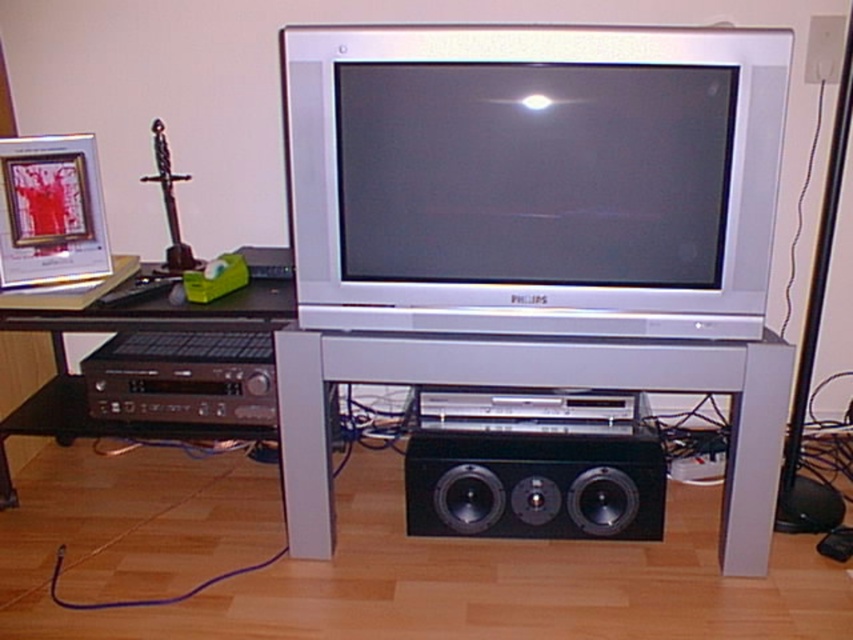
Question: Does black plastic stereo at lower left have a greater width compared to black plastic computer desk at lower left?

Choices:
 (A) no
 (B) yes

Answer: (A)

Question: Among these objects, which one is farthest from the camera?

Choices:
 (A) black plastic stereo at lower left
 (B) black plastic computer desk at lower left
 (C) black matte speaker at lower center
 (D) silver metallic flat screen tv at center

Answer: (A)

Question: Which point is farther to the camera?

Choices:
 (A) black plastic stereo at lower left
 (B) silver metallic flat screen tv at center

Answer: (A)

Question: Can you confirm if silver metallic flat screen tv at center is positioned to the left of black matte speaker at lower center?

Choices:
 (A) no
 (B) yes

Answer: (B)

Question: Does silver metallic flat screen tv at center lie in front of black matte speaker at lower center?

Choices:
 (A) yes
 (B) no

Answer: (A)

Question: Estimate the real-world distances between objects in this image. Which object is closer to the black plastic computer desk at lower left?

Choices:
 (A) silver metallic flat screen tv at center
 (B) metallic silver table at center

Answer: (B)